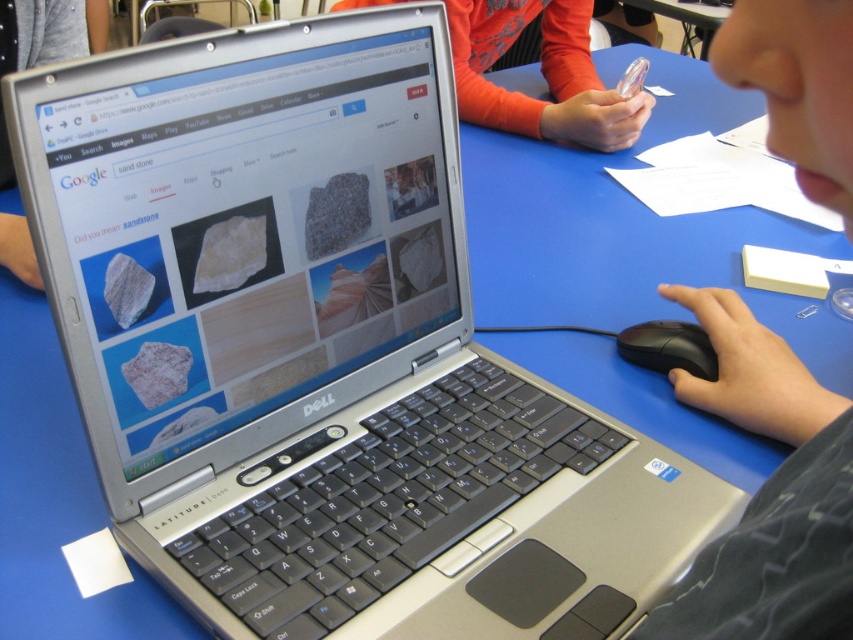
Question: Estimate the real-world distances between objects in this image. Which object is closer to the orange long-sleeve shirt at upper center?

Choices:
 (A) black plastic mouse at right
 (B) smooth skin hand at lower right

Answer: (A)

Question: Does smooth skin hand at lower right appear over black plastic mouse at right?

Choices:
 (A) yes
 (B) no

Answer: (B)

Question: Does orange long-sleeve shirt at upper center lie behind black plastic mouse at right?

Choices:
 (A) no
 (B) yes

Answer: (B)

Question: Considering the relative positions of smooth skin hand at lower right and orange long-sleeve shirt at upper center in the image provided, where is smooth skin hand at lower right located with respect to orange long-sleeve shirt at upper center?

Choices:
 (A) above
 (B) below

Answer: (B)

Question: Which point is farther to the camera?

Choices:
 (A) smooth skin hand at lower right
 (B) orange long-sleeve shirt at upper center

Answer: (B)

Question: Considering the real-world distances, which object is closest to the black plastic mouse at right?

Choices:
 (A) orange long-sleeve shirt at upper center
 (B) smooth skin hand at lower right

Answer: (B)